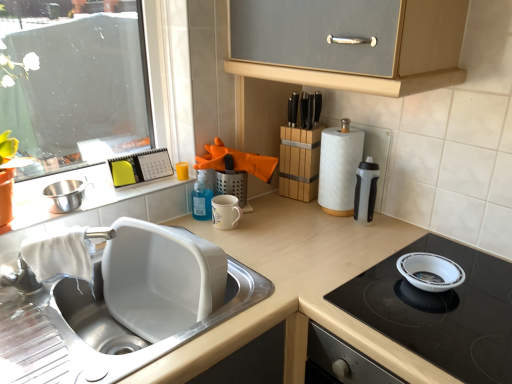
Question: From the image's perspective, is white textured paper towel at right above translucent plastic water bottle at right?

Choices:
 (A) yes
 (B) no

Answer: (A)

Question: Considering the relative sizes of white textured paper towel at right and translucent plastic water bottle at right in the image provided, is white textured paper towel at right taller than translucent plastic water bottle at right?

Choices:
 (A) yes
 (B) no

Answer: (A)

Question: Is the depth of white textured paper towel at right less than that of translucent plastic water bottle at right?

Choices:
 (A) no
 (B) yes

Answer: (A)

Question: Considering the relative sizes of white textured paper towel at right and translucent plastic water bottle at right in the image provided, is white textured paper towel at right wider than translucent plastic water bottle at right?

Choices:
 (A) no
 (B) yes

Answer: (B)

Question: From a real-world perspective, is white textured paper towel at right over translucent plastic water bottle at right?

Choices:
 (A) yes
 (B) no

Answer: (A)

Question: Is white textured paper towel at right next to translucent plastic water bottle at right and touching it?

Choices:
 (A) no
 (B) yes

Answer: (B)

Question: From a real-world perspective, is stainless steel mixing bowl at sink left positioned under white textured paper towel at right based on gravity?

Choices:
 (A) yes
 (B) no

Answer: (A)

Question: Is stainless steel mixing bowl at sink left bigger than white textured paper towel at right?

Choices:
 (A) yes
 (B) no

Answer: (B)

Question: Does stainless steel mixing bowl at sink left lie in front of white textured paper towel at right?

Choices:
 (A) no
 (B) yes

Answer: (B)

Question: Is the depth of stainless steel mixing bowl at sink left greater than that of white textured paper towel at right?

Choices:
 (A) no
 (B) yes

Answer: (A)

Question: Is stainless steel mixing bowl at sink left not within white textured paper towel at right?

Choices:
 (A) no
 (B) yes

Answer: (B)

Question: Is stainless steel mixing bowl at sink left smaller than white textured paper towel at right?

Choices:
 (A) no
 (B) yes

Answer: (B)

Question: Is matte white countertop at center outside translucent plastic water bottle at right?

Choices:
 (A) yes
 (B) no

Answer: (A)